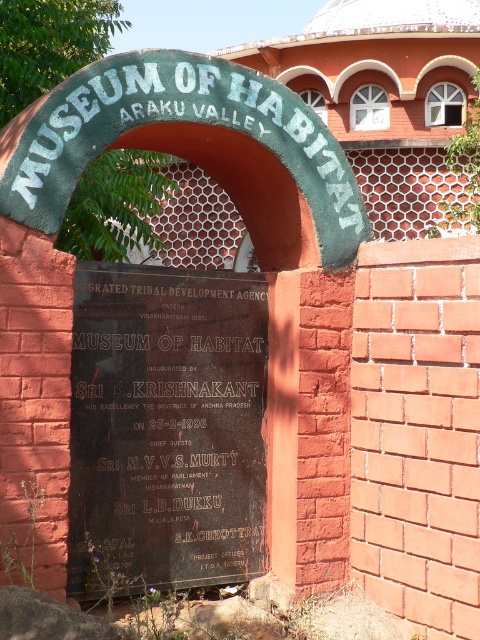
Question: Does green painted metal signboard at center appear under black polished stone plaque at center?

Choices:
 (A) no
 (B) yes

Answer: (A)

Question: Where is green painted metal signboard at center located in relation to black polished stone plaque at center in the image?

Choices:
 (A) above
 (B) below

Answer: (A)

Question: Which point appears closest to the camera in this image?

Choices:
 (A) (0, 188)
 (B) (124, 272)

Answer: (A)

Question: Which of the following is the closest to the observer?

Choices:
 (A) (110, 360)
 (B) (37, 278)

Answer: (B)

Question: Which object is closer to the camera taking this photo?

Choices:
 (A) green painted metal signboard at center
 (B) black polished stone plaque at center

Answer: (A)

Question: Does green painted metal signboard at center appear on the left side of black polished stone plaque at center?

Choices:
 (A) yes
 (B) no

Answer: (A)